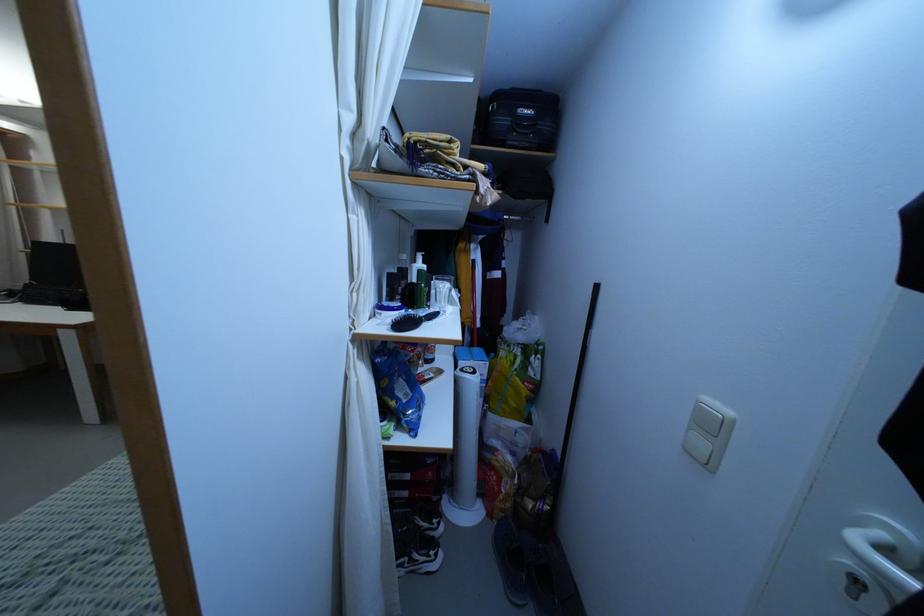
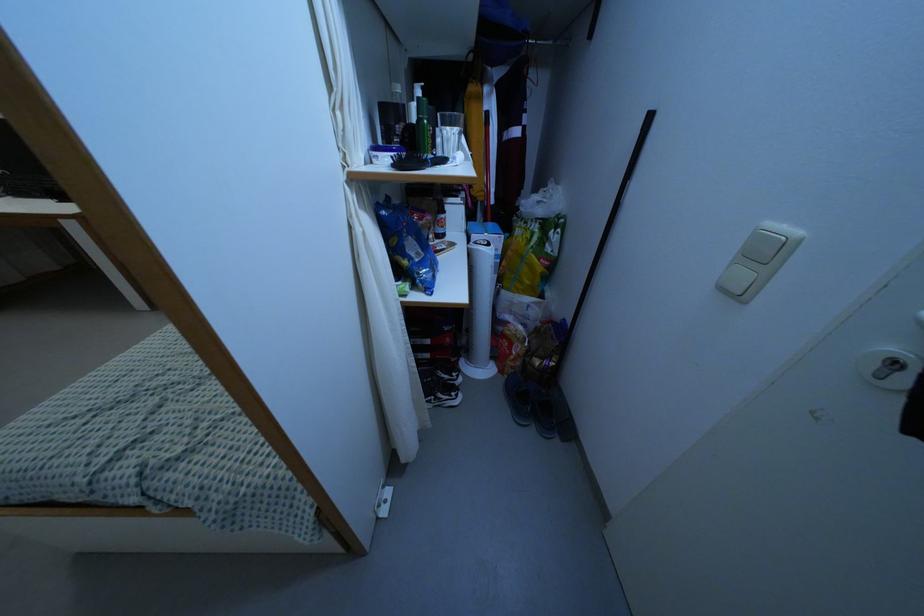
The point at (397, 399) is marked in the first image. Where is the corresponding point in the second image?

(409, 257)